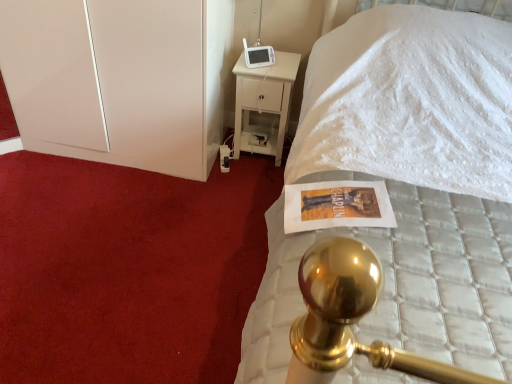
The height and width of the screenshot is (384, 512). I want to click on white glossy dresser at left, so click(x=120, y=79).

Consider the image. What is the approximate height of white glossy dresser at left?

It is 95.47 centimeters.

What do you see at coordinates (120, 79) in the screenshot?
I see `white glossy dresser at left` at bounding box center [120, 79].

Consider the image. What is the approximate width of white glossy dresser at left?

The width of white glossy dresser at left is 25.59 inches.

In the scene shown: Measure the distance between white quilted mattress at upper right and camera.

white quilted mattress at upper right is 30.21 inches away from camera.

The height and width of the screenshot is (384, 512). I want to click on white quilted mattress at upper right, so click(x=406, y=186).

This screenshot has width=512, height=384. What do you see at coordinates (406, 186) in the screenshot?
I see `white quilted mattress at upper right` at bounding box center [406, 186].

What is the approximate height of white quilted mattress at upper right?

white quilted mattress at upper right is 4.60 feet in height.

Locate an element on the screen. white glossy dresser at left is located at coordinates (120, 79).

Does white quilted mattress at upper right appear on the right side of white glossy dresser at left?

Yes, white quilted mattress at upper right is to the right of white glossy dresser at left.

Considering the relative positions of white quilted mattress at upper right and white glossy dresser at left in the image provided, is white quilted mattress at upper right behind white glossy dresser at left?

No, white quilted mattress at upper right is closer to the camera.

Is point (315, 102) in front of point (151, 147)?

Yes, it is.

From the image's perspective, which one is positioned lower, white quilted mattress at upper right or white glossy dresser at left?

white quilted mattress at upper right appears lower in the image.

From a real-world perspective, who is located higher, white quilted mattress at upper right or white glossy dresser at left?

white quilted mattress at upper right is physically above.

Does white quilted mattress at upper right have a lesser width compared to white glossy dresser at left?

Incorrect, the width of white quilted mattress at upper right is not less than that of white glossy dresser at left.

Is white quilted mattress at upper right shorter than white glossy dresser at left?

In fact, white quilted mattress at upper right may be taller than white glossy dresser at left.

Consider the image. Considering the relative sizes of white quilted mattress at upper right and white glossy dresser at left in the image provided, is white quilted mattress at upper right smaller than white glossy dresser at left?

Incorrect, white quilted mattress at upper right is not smaller in size than white glossy dresser at left.

Is white quilted mattress at upper right positioned beyond the bounds of white glossy dresser at left?

white quilted mattress at upper right lies outside white glossy dresser at left's area.

Is white quilted mattress at upper right touching white glossy dresser at left?

white quilted mattress at upper right is not next to white glossy dresser at left, and they're not touching.

Is white quilted mattress at upper right oriented towards white glossy dresser at left?

No, white quilted mattress at upper right does not turn towards white glossy dresser at left.

Identify the location of bed below the white glossy dresser at left (from the image's perspective). The height and width of the screenshot is (384, 512). (406, 186).

Can you confirm if white glossy dresser at left is positioned to the right of white quilted mattress at upper right?

No, white glossy dresser at left is not to the right of white quilted mattress at upper right.

Is white glossy dresser at left positioned in front of white quilted mattress at upper right?

No, white glossy dresser at left is further to the viewer.

In the scene shown: Which is closer, [167,59] or [452,296]?

Point [167,59].

From the image's perspective, which one is positioned higher, white glossy dresser at left or white quilted mattress at upper right?

white glossy dresser at left appears higher in the image.

From a real-world perspective, is white glossy dresser at left beneath white quilted mattress at upper right?

Indeed, from a real-world perspective, white glossy dresser at left is positioned beneath white quilted mattress at upper right.

Which of these two, white glossy dresser at left or white quilted mattress at upper right, is wider?

Wider between the two is white quilted mattress at upper right.

Based on the photo, between white glossy dresser at left and white quilted mattress at upper right, which one has more height?

white quilted mattress at upper right is taller.

Between white glossy dresser at left and white quilted mattress at upper right, which one has smaller size?

Smaller between the two is white glossy dresser at left.

Is white glossy dresser at left not within white quilted mattress at upper right?

That's correct, white glossy dresser at left is outside of white quilted mattress at upper right.

Is white glossy dresser at left directly adjacent to white quilted mattress at upper right?

No, white glossy dresser at left is not next to white quilted mattress at upper right.

Is white glossy dresser at left positioned with its back to white quilted mattress at upper right?

No, white glossy dresser at left is not facing away from white quilted mattress at upper right.

Measure the distance from white glossy dresser at left to white quilted mattress at upper right.

1.03 meters.

Where is `dresser behind the white quilted mattress at upper right`? dresser behind the white quilted mattress at upper right is located at coordinates (120, 79).

Locate an element on the screen. dresser lying on the left of white quilted mattress at upper right is located at coordinates (120, 79).

Identify the location of bed that is in front of the white glossy dresser at left. The height and width of the screenshot is (384, 512). (406, 186).